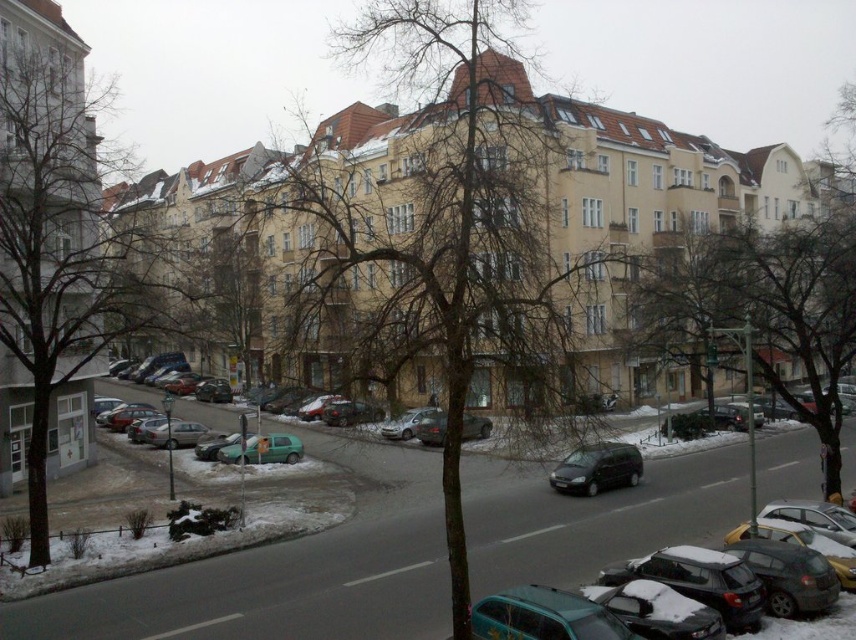
Consider the image. You are a pedestrian standing on the sidewalk and see the brown textured tree at center and the teal matte car at lower center. Which object is closer to you?

The brown textured tree at center is closer to you because it is positioned over the teal matte car at lower center, indicating it is in a more forward plane.